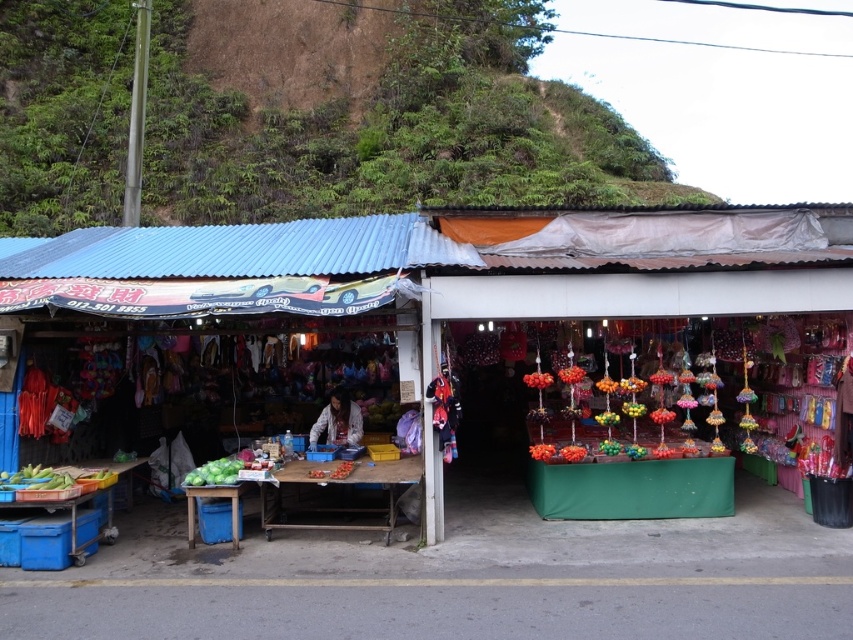
Question: Is matte plastic stall at center below green grassy hillside at upper left?

Choices:
 (A) yes
 (B) no

Answer: (A)

Question: Can you confirm if green grassy hillside at upper left is smaller than dark brown fabric vendor at center?

Choices:
 (A) no
 (B) yes

Answer: (A)

Question: Is green grassy hillside at upper left to the left of green matte cabbage at lower left from the viewer's perspective?

Choices:
 (A) no
 (B) yes

Answer: (A)

Question: Which is nearer to the green grassy hillside at upper left?

Choices:
 (A) dark brown fabric vendor at center
 (B) matte plastic stall at center
 (C) green matte cabbage at lower left

Answer: (B)

Question: Considering the real-world distances, which object is closest to the green matte cabbage at lower left?

Choices:
 (A) dark brown fabric vendor at center
 (B) green grassy hillside at upper left
 (C) matte plastic stall at center

Answer: (A)

Question: Which point appears farthest from the camera in this image?

Choices:
 (A) (200, 472)
 (B) (345, 410)
 (C) (184, 262)

Answer: (B)